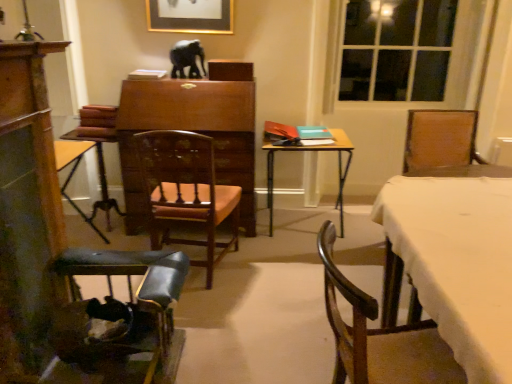
Question: Does shiny black elephant at center have a lesser height compared to wooden chair at lower right, the 1th chair positioned from the right?

Choices:
 (A) no
 (B) yes

Answer: (B)

Question: Considering the relative positions of shiny black elephant at center and wooden chair at lower right, the 1th chair positioned from the right, in the image provided, is shiny black elephant at center in front of wooden chair at lower right, the 1th chair positioned from the right,?

Choices:
 (A) yes
 (B) no

Answer: (B)

Question: Considering the relative positions of shiny black elephant at center and wooden chair at lower right, the third chair positioned from the left, in the image provided, is shiny black elephant at center to the left of wooden chair at lower right, the third chair positioned from the left, from the viewer's perspective?

Choices:
 (A) yes
 (B) no

Answer: (A)

Question: Is shiny black elephant at center positioned beyond the bounds of wooden chair at lower right, the 1th chair positioned from the right?

Choices:
 (A) no
 (B) yes

Answer: (B)

Question: Can you confirm if shiny black elephant at center is taller than wooden chair at lower right, the third chair positioned from the left?

Choices:
 (A) yes
 (B) no

Answer: (B)

Question: Considering the positions of shiny black elephant at center and metallic blue chair at lower left, which is counted as the first chair, starting from the left, in the image, is shiny black elephant at center wider or thinner than metallic blue chair at lower left, which is counted as the first chair, starting from the left,?

Choices:
 (A) wide
 (B) thin

Answer: (B)

Question: Is point (169, 57) closer or farther from the camera than point (96, 297)?

Choices:
 (A) farther
 (B) closer

Answer: (A)

Question: In the image, is shiny black elephant at center on the left side or the right side of metallic blue chair at lower left, which is counted as the first chair, starting from the left?

Choices:
 (A) left
 (B) right

Answer: (B)

Question: Considering the positions of shiny black elephant at center and metallic blue chair at lower left, the 3th chair in the right-to-left sequence, in the image, is shiny black elephant at center taller or shorter than metallic blue chair at lower left, the 3th chair in the right-to-left sequence,?

Choices:
 (A) tall
 (B) short

Answer: (B)

Question: In terms of width, does wooden dresser at left look wider or thinner when compared to wooden chair at lower right, the third chair positioned from the left?

Choices:
 (A) wide
 (B) thin

Answer: (B)

Question: Considering the positions of wooden dresser at left and wooden chair at lower right, the 1th chair positioned from the right, in the image, is wooden dresser at left taller or shorter than wooden chair at lower right, the 1th chair positioned from the right,?

Choices:
 (A) short
 (B) tall

Answer: (B)

Question: Considering their positions, is wooden dresser at left located in front of or behind wooden chair at lower right, the 1th chair positioned from the right?

Choices:
 (A) behind
 (B) front

Answer: (A)

Question: Is point (23, 160) closer or farther from the camera than point (345, 331)?

Choices:
 (A) closer
 (B) farther

Answer: (B)

Question: In terms of size, does wooden dresser at left appear bigger or smaller than wooden polished chair at center, which is the 2th chair from right to left?

Choices:
 (A) big
 (B) small

Answer: (B)

Question: Is wooden dresser at left in front of or behind wooden polished chair at center, which is the 2th chair from right to left, in the image?

Choices:
 (A) behind
 (B) front

Answer: (B)